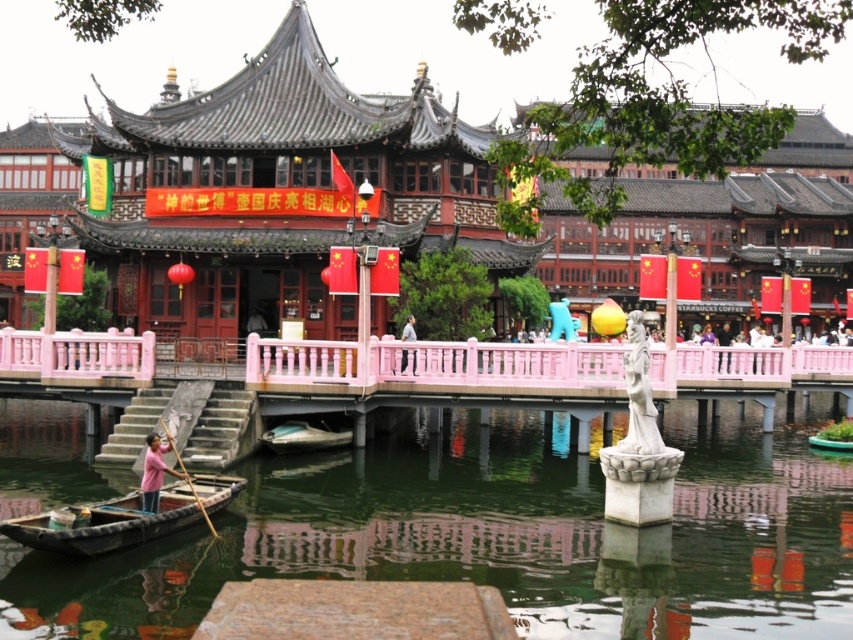
Question: Which object appears farthest from the camera in this image?

Choices:
 (A) pink fabric person at lower left
 (B) light blue fabric shirt at center
 (C) wooden boat at center

Answer: (C)

Question: Observing the image, what is the correct spatial positioning of green reflective water at lower center in reference to wooden boat at center?

Choices:
 (A) below
 (B) above

Answer: (A)

Question: Does green reflective water at lower center come in front of light blue fabric shirt at center?

Choices:
 (A) no
 (B) yes

Answer: (B)

Question: Among these points, which one is nearest to the camera?

Choices:
 (A) (399, 337)
 (B) (148, 440)
 (C) (125, 532)
 (D) (96, 632)

Answer: (D)

Question: Among these objects, which one is farthest from the camera?

Choices:
 (A) wooden canoe at lower left
 (B) wooden boat at center
 (C) wooden at left
 (D) green reflective water at lower center

Answer: (B)

Question: In this image, where is wooden boat at center located relative to pink fabric person at lower left?

Choices:
 (A) right
 (B) left

Answer: (A)